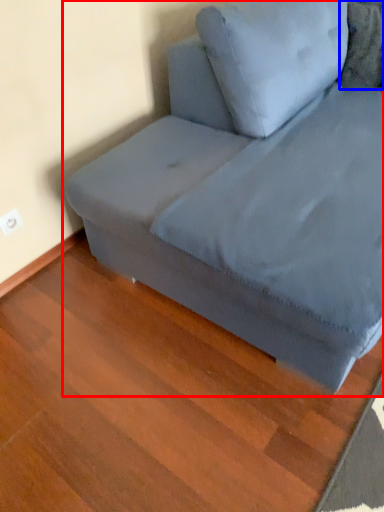
Question: Which object appears farthest to the camera in this image, studio couch (highlighted by a red box) or pillow (highlighted by a blue box)?

Choices:
 (A) studio couch
 (B) pillow

Answer: (B)